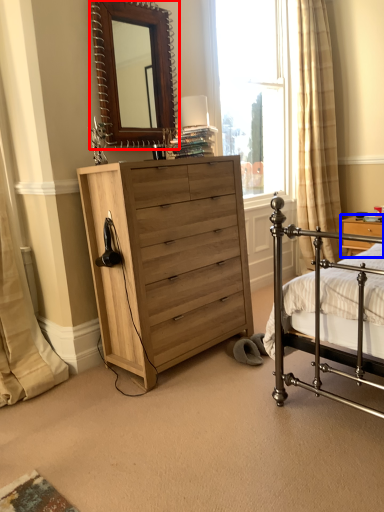
Question: Which of the following is the farthest to the observer, mirror (highlighted by a red box) or nightstand (highlighted by a blue box)?

Choices:
 (A) mirror
 (B) nightstand

Answer: (B)